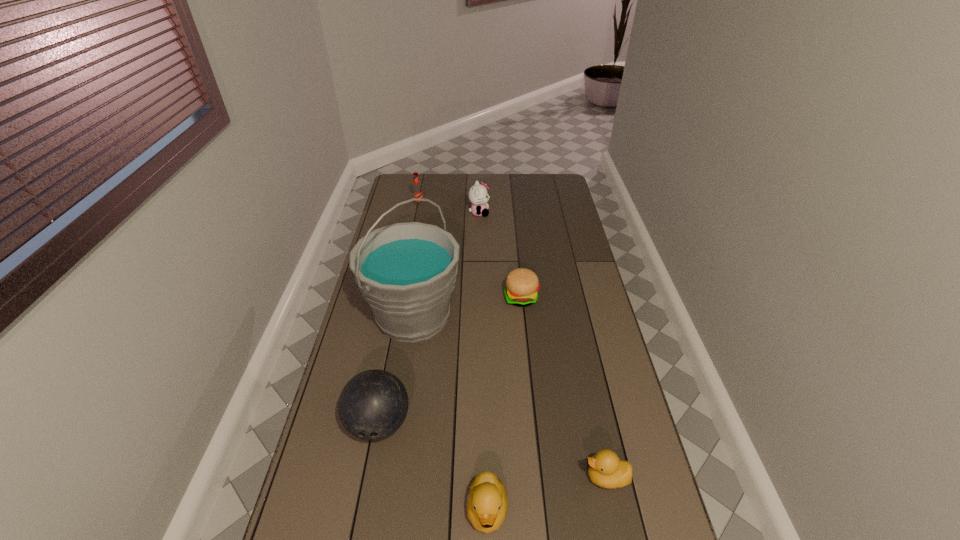
Where is `the right duckling`? the right duckling is located at coordinates (606, 470).

Where is `the rightmost object`? This screenshot has height=540, width=960. the rightmost object is located at coordinates (606, 470).

This screenshot has height=540, width=960. What are the coordinates of `root beer` in the screenshot? It's located at (417, 192).

Image resolution: width=960 pixels, height=540 pixels. I want to click on kitten, so click(x=478, y=195).

You are a GUI agent. You are given a task and a screenshot of the screen. Output one action in this format:
    pyautogui.click(x=<x>, y=<y>)
    Task: Click on the bucket
    The width and height of the screenshot is (960, 540).
    Given the screenshot: What is the action you would take?
    pyautogui.click(x=406, y=272)

Find the location of a particular element. This screenshot has height=540, width=960. bowling ball is located at coordinates (373, 405).

Identify the location of the sixth object from left to right. The width and height of the screenshot is (960, 540). pyautogui.click(x=522, y=285).

Where is `vacant region located 0.330m facing forward on the rightmost object`? The image size is (960, 540). vacant region located 0.330m facing forward on the rightmost object is located at coordinates (458, 477).

You are a GUI agent. You are given a task and a screenshot of the screen. Output one action in this format:
    pyautogui.click(x=<x>, y=<y>)
    Task: Click on the vacant area located 0.110m facing forward on the rightmost object
    
    Given the screenshot: What is the action you would take?
    pyautogui.click(x=541, y=477)

Locate an element on the screen. vacant space located facing forward on the rightmost object is located at coordinates (444, 477).